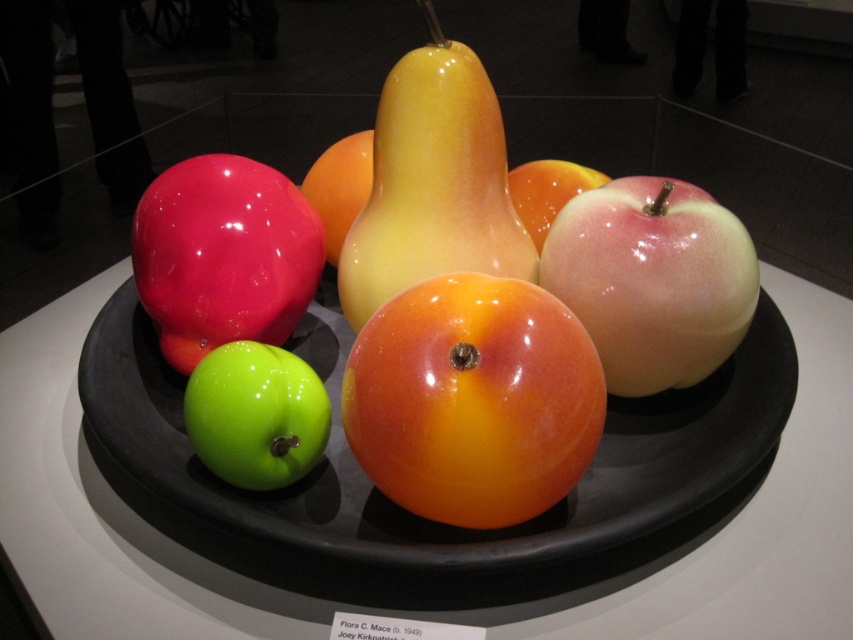
Looking at this image, can you confirm if glossy orange apple at center is bigger than green glossy apple at lower left?

Yes.

Is glossy orange apple at center wider than green glossy apple at lower left?

Indeed, glossy orange apple at center has a greater width compared to green glossy apple at lower left.

Is point (572, 422) positioned after point (227, 472)?

No, it is in front of (227, 472).

Where is `glossy orange apple at center`? The width and height of the screenshot is (853, 640). glossy orange apple at center is located at coordinates (473, 401).

Does glossy orange apple at center have a greater width compared to glossy apple at center?

Indeed, glossy orange apple at center has a greater width compared to glossy apple at center.

Can you confirm if glossy orange apple at center is positioned below glossy apple at center?

Yes, glossy orange apple at center is below glossy apple at center.

The image size is (853, 640). What do you see at coordinates (473, 401) in the screenshot? I see `glossy orange apple at center` at bounding box center [473, 401].

In order to click on glossy orange apple at center in this screenshot , I will do `click(473, 401)`.

Is point (778, 378) positioned before point (434, 472)?

No, it is behind (434, 472).

Find the location of a particular element. glossy ceramic platter at center is located at coordinates (413, 515).